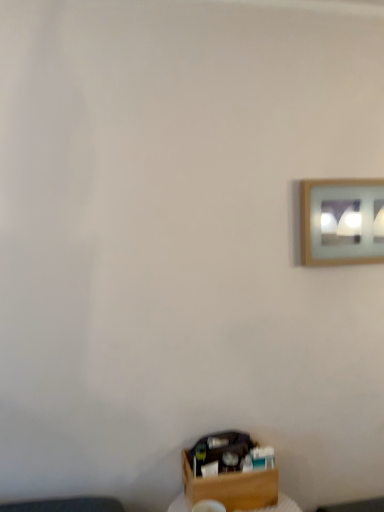
This screenshot has height=512, width=384. What do you see at coordinates (227, 474) in the screenshot?
I see `wooden box at lower center` at bounding box center [227, 474].

This screenshot has width=384, height=512. I want to click on wooden box at lower center, so click(x=227, y=474).

The width and height of the screenshot is (384, 512). Identify the location of wooden frame at upper right. (342, 221).

What is the approximate width of wooden frame at upper right?

The width of wooden frame at upper right is 1.97 inches.

Describe the element at coordinates (342, 221) in the screenshot. I see `wooden frame at upper right` at that location.

Where is `wooden box at lower center`? The width and height of the screenshot is (384, 512). wooden box at lower center is located at coordinates (227, 474).

Consider the image. In the image, is wooden box at lower center on the left side or the right side of wooden frame at upper right?

Based on their positions, wooden box at lower center is located to the left of wooden frame at upper right.

Which object is further away from the camera, wooden box at lower center or wooden frame at upper right?

Positioned behind is wooden frame at upper right.

Which is in front, point (221, 488) or point (336, 264)?

Positioned in front is point (221, 488).

From the image's perspective, is wooden box at lower center on wooden frame at upper right?

Incorrect, from the image's perspective, wooden box at lower center is lower than wooden frame at upper right.

From a real-world perspective, does wooden box at lower center sit lower than wooden frame at upper right?

Yes.

Which object is wider, wooden box at lower center or wooden frame at upper right?

With larger width is wooden box at lower center.

Considering the sizes of objects wooden box at lower center and wooden frame at upper right in the image provided, who is shorter, wooden box at lower center or wooden frame at upper right?

wooden box at lower center.

Between wooden box at lower center and wooden frame at upper right, which one has smaller size?

wooden frame at upper right.

Is wooden box at lower center located outside wooden frame at upper right?

wooden box at lower center lies outside wooden frame at upper right's area.

Are wooden box at lower center and wooden frame at upper right making contact?

wooden box at lower center is not next to wooden frame at upper right, and they're not touching.

Based on the photo, is wooden box at lower center aimed at wooden frame at upper right?

No, wooden box at lower center is not turned towards wooden frame at upper right.

Measure the distance from wooden box at lower center to wooden frame at upper right.

The distance of wooden box at lower center from wooden frame at upper right is 33.06 inches.

Locate an element on the screen. The width and height of the screenshot is (384, 512). box to the left of wooden frame at upper right is located at coordinates (227, 474).

Considering the relative positions of wooden frame at upper right and wooden box at lower center in the image provided, is wooden frame at upper right to the left of wooden box at lower center from the viewer's perspective?

No, wooden frame at upper right is not to the left of wooden box at lower center.

Is the depth of wooden frame at upper right greater than that of wooden box at lower center?

Yes, it is.

Is point (353, 253) behind point (196, 482)?

Yes.

From the image's perspective, is wooden frame at upper right below wooden box at lower center?

Actually, wooden frame at upper right appears above wooden box at lower center in the image.

From a real-world perspective, between wooden frame at upper right and wooden box at lower center, who is vertically higher?

wooden frame at upper right, from a real-world perspective.

In the scene shown: Between wooden frame at upper right and wooden box at lower center, which one has smaller width?

wooden frame at upper right.

Considering the sizes of wooden frame at upper right and wooden box at lower center in the image, is wooden frame at upper right taller or shorter than wooden box at lower center?

In the image, wooden frame at upper right appears to be taller than wooden box at lower center.

Considering the sizes of objects wooden frame at upper right and wooden box at lower center in the image provided, who is bigger, wooden frame at upper right or wooden box at lower center?

With larger size is wooden box at lower center.

Would you say wooden frame at upper right is outside wooden box at lower center?

Yes, wooden frame at upper right is located beyond the bounds of wooden box at lower center.

Would you consider wooden frame at upper right to be distant from wooden box at lower center?

No, there isn't a large distance between wooden frame at upper right and wooden box at lower center.

Is wooden frame at upper right facing away from wooden box at lower center?

No, wooden frame at upper right's orientation is not away from wooden box at lower center.

What's the angular difference between wooden frame at upper right and wooden box at lower center's facing directions?

They differ by 0.0202 degrees in their facing directions.

This screenshot has height=512, width=384. What are the coordinates of `picture frame lying on the right of wooden box at lower center` in the screenshot? It's located at tap(342, 221).

In the image, there is a wooden frame at upper right. What are the coordinates of `box below it (from a real-world perspective)` in the screenshot? It's located at (227, 474).

This screenshot has height=512, width=384. Find the location of `box to the left of wooden frame at upper right`. box to the left of wooden frame at upper right is located at coordinates (227, 474).